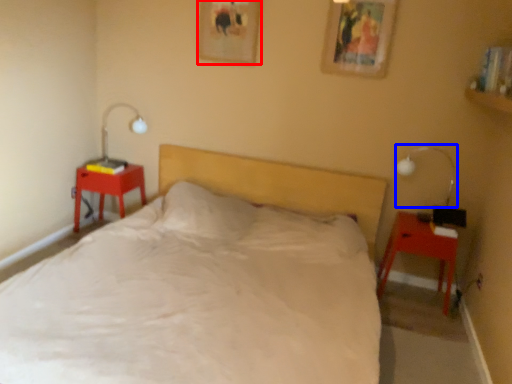
Question: Which object appears farthest to the camera in this image, picture frame (highlighted by a red box) or bedside lamp (highlighted by a blue box)?

Choices:
 (A) picture frame
 (B) bedside lamp

Answer: (A)